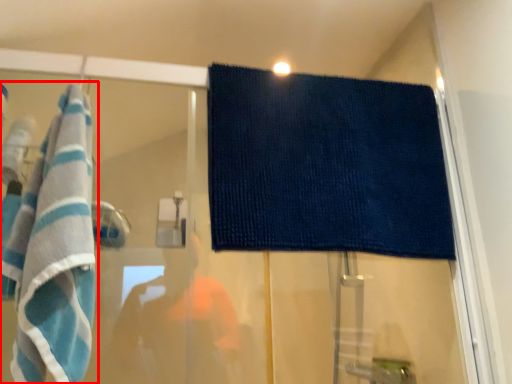
Question: Observing the image, what is the correct spatial positioning of towel (annotated by the red box) in reference to towel?

Choices:
 (A) left
 (B) right

Answer: (A)